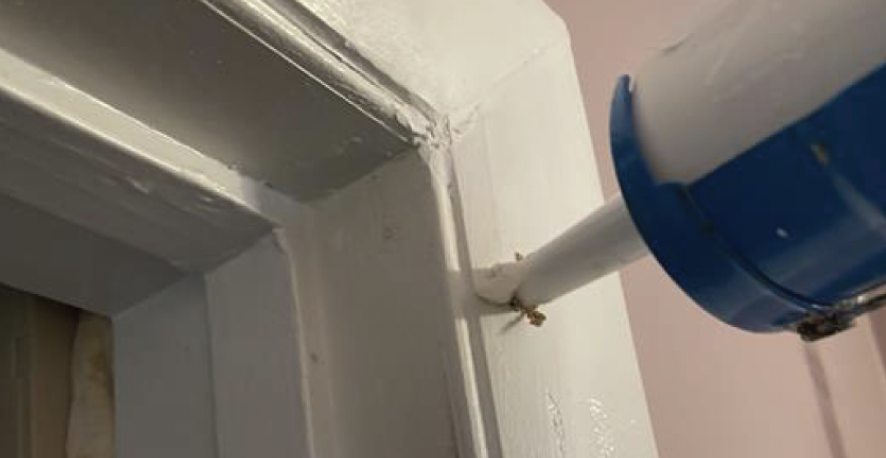
You are a GUI agent. You are given a task and a screenshot of the screen. Output one action in this format:
    pyautogui.click(x=<x>, y=<y>)
    Task: Click on the wall
    This screenshot has height=458, width=886.
    Given the screenshot: What is the action you would take?
    pyautogui.click(x=758, y=389)